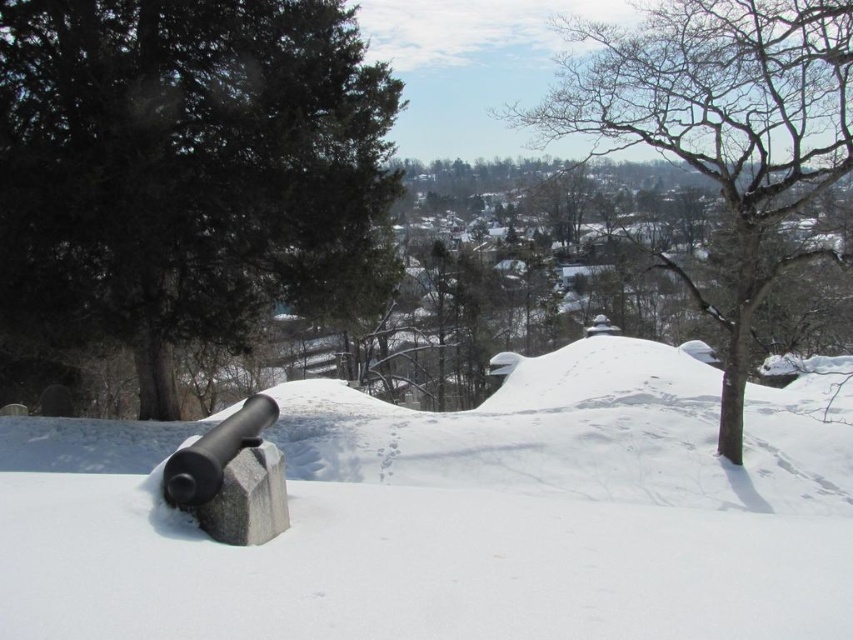
Does dark green textured tree at upper left have a lesser height compared to bare wood tree at upper right?

Yes.

Is point (231, 282) more distant than point (775, 3)?

Yes.

Find the location of a particular element. This screenshot has width=853, height=640. dark green textured tree at upper left is located at coordinates (186, 170).

Between bare wood tree at upper right and gray stone cannon at lower left, which one has less height?

Standing shorter between the two is gray stone cannon at lower left.

Who is higher up, bare wood tree at upper right or gray stone cannon at lower left?

Positioned higher is bare wood tree at upper right.

Where is `bare wood tree at upper right`? The image size is (853, 640). bare wood tree at upper right is located at coordinates (722, 131).

Does white matte snow at center have a lesser height compared to dark green textured tree at upper left?

Yes, white matte snow at center is shorter than dark green textured tree at upper left.

Locate an element on the screen. The height and width of the screenshot is (640, 853). white matte snow at center is located at coordinates (473, 520).